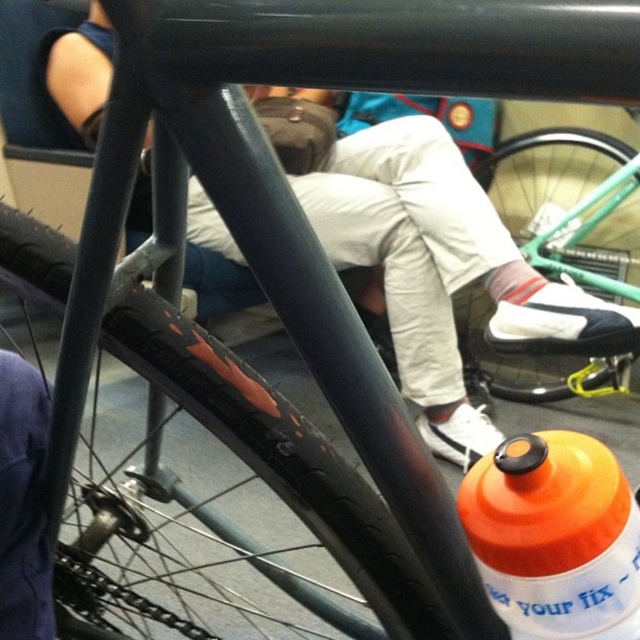
Question: Which of the following is the closest to the observer?

Choices:
 (A) orange matte bottle at center
 (B) green rubber tire at lower center
 (C) dark blue fabric at lower left

Answer: (A)

Question: Which of the following is the closest to the observer?

Choices:
 (A) green rubber tire at lower center
 (B) black rubber tire at center

Answer: (B)

Question: Does black rubber tire at center have a lesser width compared to dark blue fabric at lower left?

Choices:
 (A) yes
 (B) no

Answer: (B)

Question: Considering the relative positions of orange matte bottle at center and dark blue fabric at lower left in the image provided, where is orange matte bottle at center located with respect to dark blue fabric at lower left?

Choices:
 (A) left
 (B) right

Answer: (B)

Question: Estimate the real-world distances between objects in this image. Which object is farther from the dark blue fabric at lower left?

Choices:
 (A) black rubber tire at center
 (B) orange matte bottle at center
 (C) green rubber tire at lower center

Answer: (C)

Question: Can you confirm if black rubber tire at center is bigger than dark blue fabric at lower left?

Choices:
 (A) no
 (B) yes

Answer: (B)